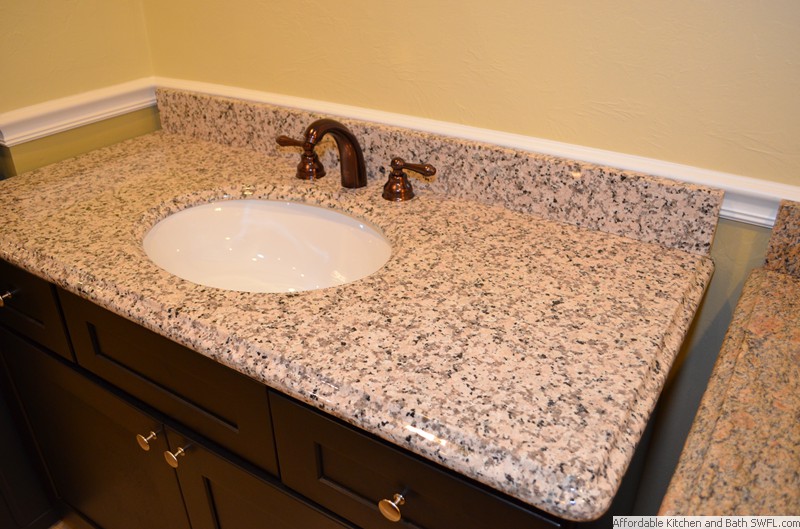
The width and height of the screenshot is (800, 529). What are the coordinates of `drawers` in the screenshot? It's located at (56, 337), (310, 468).